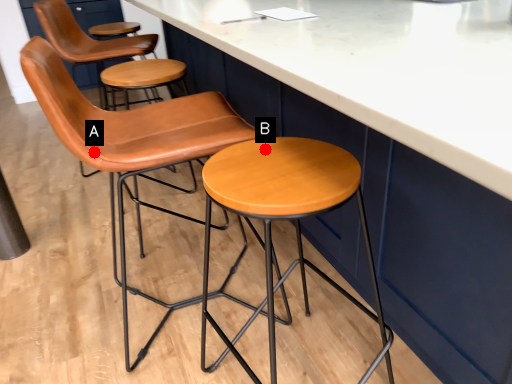
Question: Two points are circled on the image, labeled by A and B beside each circle. Which of the following is the closest to the observer?

Choices:
 (A) A is closer
 (B) B is closer

Answer: (B)